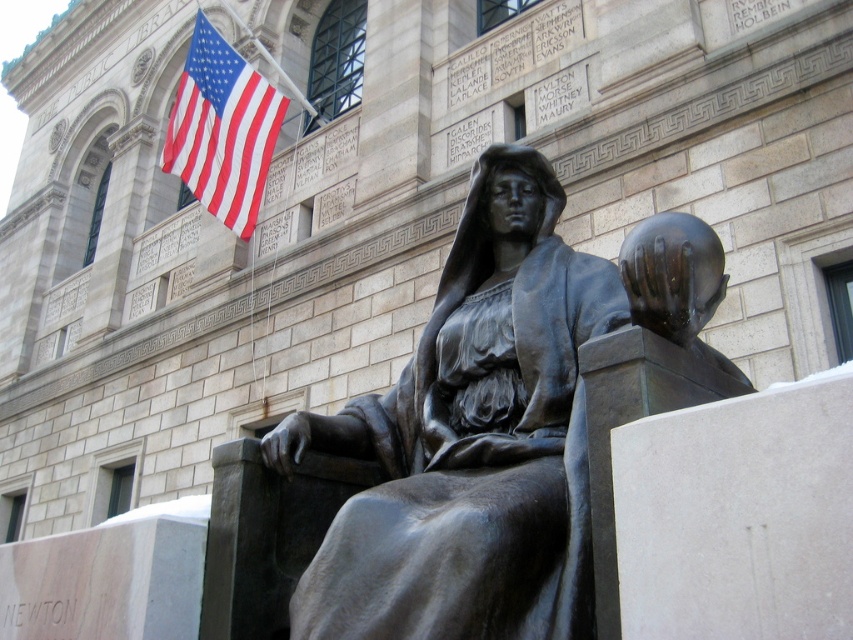
Question: Is bronze statue at center smaller than red-white striped fabric at upper left?

Choices:
 (A) yes
 (B) no

Answer: (A)

Question: Which of the following is the farthest from the observer?

Choices:
 (A) (215, 179)
 (B) (398, 413)

Answer: (A)

Question: Which of the following is the farthest from the observer?

Choices:
 (A) bronze statue at center
 (B) red-white striped fabric at upper left

Answer: (B)

Question: Is bronze statue at center thinner than red-white striped fabric at upper left?

Choices:
 (A) yes
 (B) no

Answer: (A)

Question: Which of the following is the closest to the observer?

Choices:
 (A) bronze statue at center
 (B) red-white striped fabric at upper left

Answer: (A)

Question: Is bronze statue at center bigger than red-white striped fabric at upper left?

Choices:
 (A) yes
 (B) no

Answer: (B)